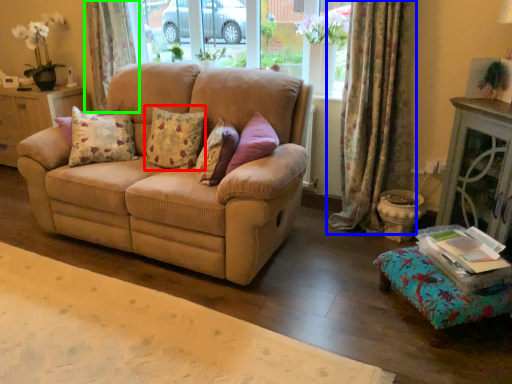
Question: Estimate the real-world distances between objects in this image. Which object is closer to pillow (highlighted by a red box), curtain (highlighted by a blue box) or curtain (highlighted by a green box)?

Choices:
 (A) curtain
 (B) curtain

Answer: (A)